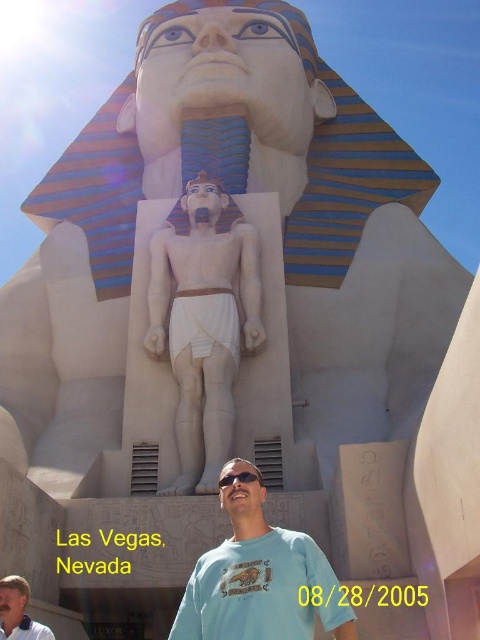
You are standing in front of the ancient Egyptian statue and want to take a photo. You notice two points marked on the statue. The first point is at coordinate point[160,298] and the second is at point[313,556]. Which point is closer to you?

Point[160,298] is closer to you because it is further to the viewer than point[313,556].